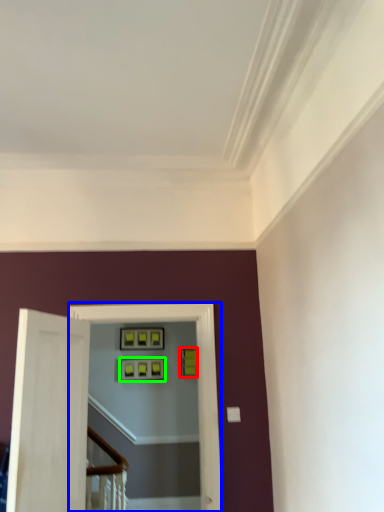
Question: Based on their relative distances, which object is nearer to picture frame (highlighted by a red box)? Choose from passage (highlighted by a blue box) and picture frame (highlighted by a green box).

Choices:
 (A) passage
 (B) picture frame

Answer: (B)